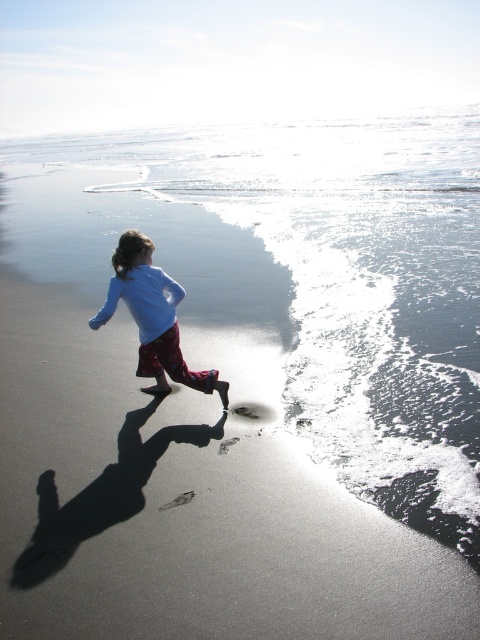
Question: Which object is the closest to the light blue fabric shirt at center?

Choices:
 (A) brown sandy footprint at lower center
 (B) sandy beach at lower left

Answer: (A)

Question: Does light blue fabric shirt at center have a smaller size compared to brown sandy footprint at lower center?

Choices:
 (A) no
 (B) yes

Answer: (A)

Question: Where is sandy beach at lower left located in relation to light blue fabric shirt at center in the image?

Choices:
 (A) right
 (B) left

Answer: (B)

Question: Which of the following is the farthest from the observer?

Choices:
 (A) brown sandy footprint at lower center
 (B) light blue fabric shirt at center
 (C) sandy beach at lower left

Answer: (B)

Question: Which point is closer to the camera taking this photo?

Choices:
 (A) (127, 378)
 (B) (164, 275)

Answer: (B)

Question: Can you confirm if sandy beach at lower left is positioned to the left of light blue fabric shirt at center?

Choices:
 (A) yes
 (B) no

Answer: (A)